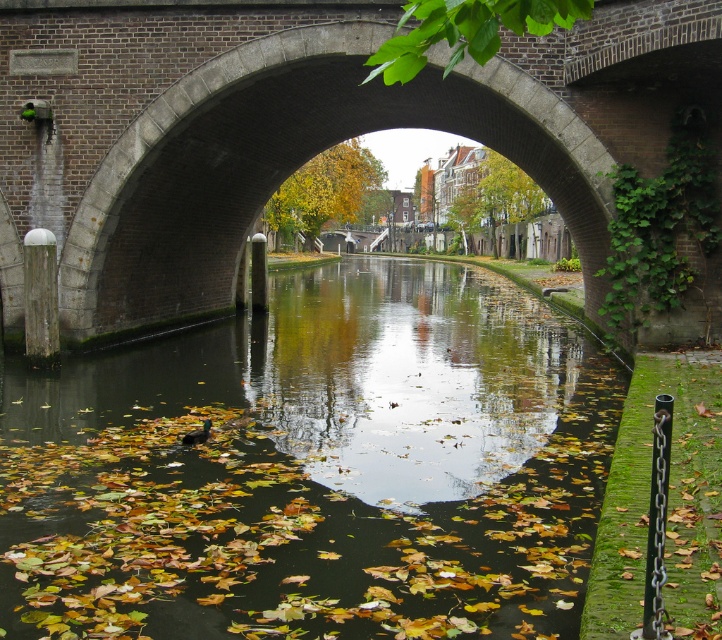
Question: Which point is farther from the camera taking this photo?

Choices:
 (A) (471, 314)
 (B) (152, 112)

Answer: (A)

Question: Which object is farther from the camera taking this photo?

Choices:
 (A) brick stone bridge at center
 (B) green mossy canal at center

Answer: (A)

Question: Does green mossy canal at center have a lesser width compared to brick stone bridge at center?

Choices:
 (A) no
 (B) yes

Answer: (A)

Question: Among these objects, which one is farthest from the camera?

Choices:
 (A) brick stone bridge at center
 (B) green mossy canal at center

Answer: (A)

Question: Is green mossy canal at center bigger than brick stone bridge at center?

Choices:
 (A) yes
 (B) no

Answer: (B)

Question: Does green mossy canal at center have a greater width compared to brick stone bridge at center?

Choices:
 (A) no
 (B) yes

Answer: (B)